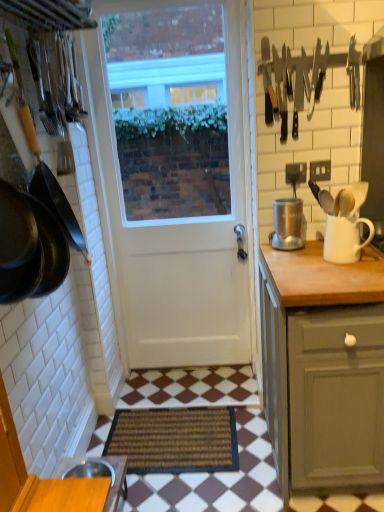
What is the approximate width of white glossy jug at right?

white glossy jug at right is 8.09 inches wide.

What do you see at coordinates (185, 240) in the screenshot? I see `white matte door at center` at bounding box center [185, 240].

Identify the location of stainless steel knives at upper right. (291, 82).

Where is `black matte frying pan at left`? This screenshot has height=512, width=384. black matte frying pan at left is located at coordinates (51, 187).

What do you see at coordinates (323, 368) in the screenshot? I see `matte gray cabinet at right` at bounding box center [323, 368].

Identify the location of white glossy jug at right. The image size is (384, 512). (344, 239).

Is matte gray cabinet at right inside black matte frying pan at left?

Definitely not — matte gray cabinet at right is not inside black matte frying pan at left.

Is black matte frying pan at left positioned far away from matte gray cabinet at right?

They are positioned close to each other.

Is black matte frying pan at left closer to the viewer compared to matte gray cabinet at right?

No, it is behind matte gray cabinet at right.

You are a GUI agent. You are given a task and a screenshot of the screen. Output one action in this format:
    pyautogui.click(x=<x>, y=<y>)
    Task: Click on the frying pan that is above the matte gray cabinet at right (from a real-world perspective)
    Image resolution: width=384 pixels, height=512 pixels.
    Given the screenshot: What is the action you would take?
    pyautogui.click(x=51, y=187)

Is wooden table at lower left positioned beyond the bounds of white glossy jug at right?

That's correct, wooden table at lower left is outside of white glossy jug at right.

Considering the sizes of objects wooden table at lower left and white glossy jug at right in the image provided, who is taller, wooden table at lower left or white glossy jug at right?

With more height is wooden table at lower left.

Is wooden table at lower left thinner than white glossy jug at right?

No, wooden table at lower left is not thinner than white glossy jug at right.

From the picture: From a real-world perspective, is wooden table at lower left physically above white glossy jug at right?

No, from a real-world perspective, wooden table at lower left is not over white glossy jug at right

Is wooden table at lower left turned away from white matte door at center?

No, white matte door at center is not at the back of wooden table at lower left.

Is wooden table at lower left closer to camera compared to white matte door at center?

Yes, wooden table at lower left is in front of white matte door at center.

Is wooden table at lower left next to white matte door at center?

There is a gap between wooden table at lower left and white matte door at center.

From their relative heights in the image, would you say wooden table at lower left is taller or shorter than white matte door at center?

Clearly, wooden table at lower left is shorter compared to white matte door at center.

Is matte gray cabinet at right located outside white glossy jug at right?

Absolutely, matte gray cabinet at right is external to white glossy jug at right.

Can you tell me how much matte gray cabinet at right and white glossy jug at right differ in facing direction?

0.573 degrees separate the facing orientations of matte gray cabinet at right and white glossy jug at right.

Is point (348, 279) farther from camera compared to point (344, 219)?

No.

Identify the location of cabinetry in front of the white glossy jug at right. (323, 368).

From a real-world perspective, is silver metallic coffee grinder at right on matte gray cabinet at right?

Yes, from a real-world perspective, silver metallic coffee grinder at right is on top of matte gray cabinet at right.

Is the depth of silver metallic coffee grinder at right greater than that of matte gray cabinet at right?

That is True.

Would you say matte gray cabinet at right is part of silver metallic coffee grinder at right's contents?

Actually, matte gray cabinet at right is outside silver metallic coffee grinder at right.

Considering the relative positions of silver metallic coffee grinder at right and matte gray cabinet at right in the image provided, is silver metallic coffee grinder at right to the left of matte gray cabinet at right from the viewer's perspective?

Yes, silver metallic coffee grinder at right is to the left of matte gray cabinet at right.

From a real-world perspective, who is located lower, brown woven mat at center or black matte frying pan at left?

brown woven mat at center.

Which point is more distant from viewer, (126,421) or (55,196)?

The point (126,421) is more distant.

From the image's perspective, which object appears higher, brown woven mat at center or black matte frying pan at left?

From the image's view, black matte frying pan at left is above.

Considering the positions of objects brown woven mat at center and black matte frying pan at left in the image provided, who is more to the right, brown woven mat at center or black matte frying pan at left?

brown woven mat at center.

Consider the image. Choose the correct answer: Is white glossy jug at right inside silver metallic coffee grinder at right or outside it?

The correct answer is: outside.

At what (x,y) coordinates should I click in order to perform the action: click on kitchen appliance behind the white glossy jug at right. Please return your answer as a coordinate pair (x, y). This screenshot has height=512, width=384. Looking at the image, I should click on click(288, 224).

From a real-world perspective, which object rests below the other?

From a 3D spatial view, white glossy jug at right is below.

Locate an element on the screen. Image resolution: width=384 pixels, height=512 pixels. cabinetry directly beneath the black matte frying pan at left (from a real-world perspective) is located at coordinates (323, 368).

This screenshot has width=384, height=512. In order to click on table that is on the left side of white glossy jug at right in this screenshot , I will do `click(116, 482)`.

Looking at the image, which one is located further to wooden table at lower left, silver metallic coffee grinder at right or white matte door at center?

silver metallic coffee grinder at right lies further to wooden table at lower left than the other object.

Based on the photo, which object lies nearer to the anchor point white glossy jug at right, wooden table at lower left or black matte frying pan at left?

black matte frying pan at left.

Estimate the real-world distances between objects in this image. Which object is further from black matte frying pan at left, silver metallic coffee grinder at right or stainless steel knives at upper right?

stainless steel knives at upper right.

Estimate the real-world distances between objects in this image. Which object is further from brown woven mat at center, wooden table at lower left or silver metallic coffee grinder at right?

Among the two, silver metallic coffee grinder at right is located further to brown woven mat at center.

Estimate the real-world distances between objects in this image. Which object is closer to matte gray cabinet at right, white matte door at center or wooden table at lower left?

white matte door at center lies closer to matte gray cabinet at right than the other object.

Which object lies further to the anchor point wooden table at lower left, brown woven mat at center or black matte frying pan at left?

Among the two, black matte frying pan at left is located further to wooden table at lower left.

Which object lies nearer to the anchor point wooden table at lower left, matte gray cabinet at right or brown woven mat at center?

brown woven mat at center is closer to wooden table at lower left.

Looking at the image, which one is located further to black matte frying pan at left, matte gray cabinet at right or brown woven mat at center?

brown woven mat at center lies further to black matte frying pan at left than the other object.

The width and height of the screenshot is (384, 512). What are the coordinates of `door between black matte frying pan at left and stainless steel knives at upper right in the horizontal direction` in the screenshot? It's located at (185, 240).

Identify the location of cabinetry between black matte frying pan at left and brown woven mat at center in the vertical direction. (323, 368).

I want to click on door between stainless steel knives at upper right and wooden table at lower left in the vertical direction, so click(x=185, y=240).

Identify the location of door between stainless steel knives at upper right and brown woven mat at center from top to bottom. The height and width of the screenshot is (512, 384). coord(185,240).